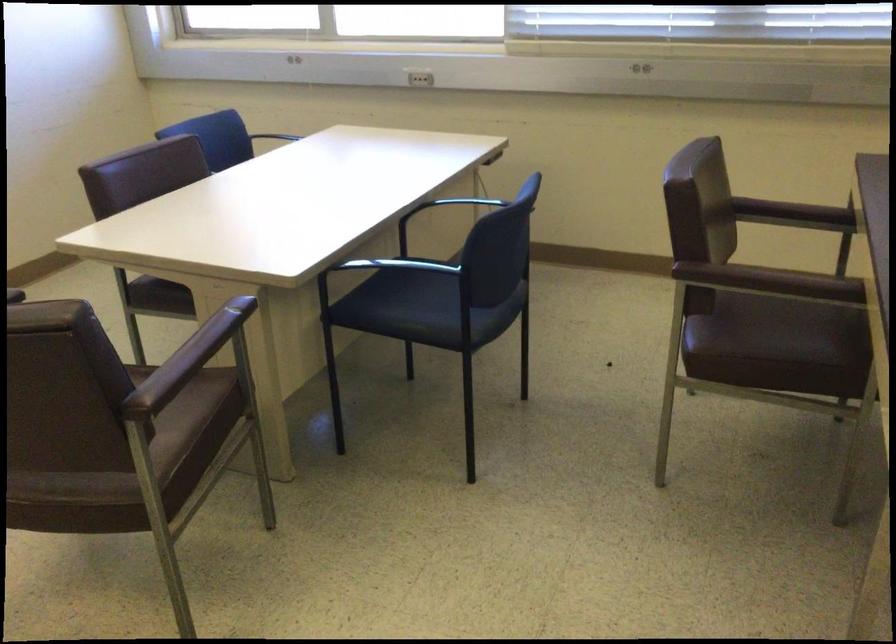
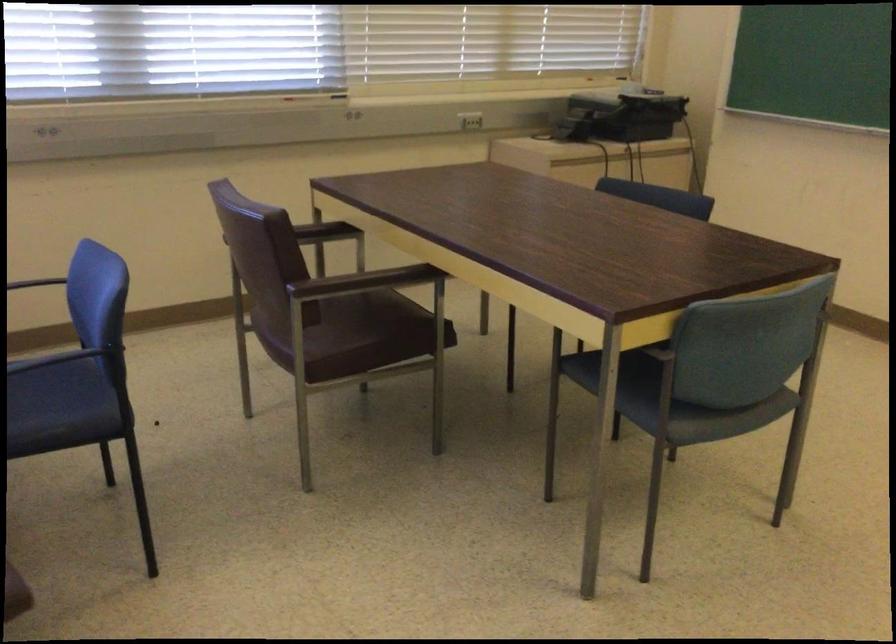
Where in the second image is the point corresponding to point 757,276 from the first image?

(362, 281)